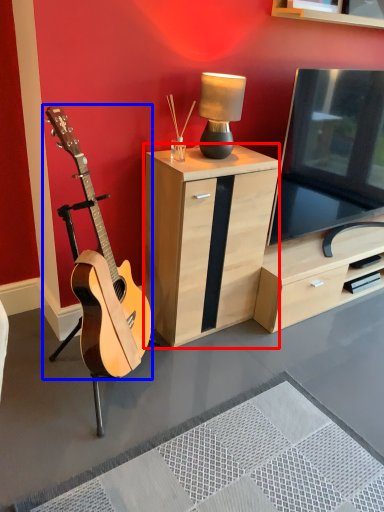
Question: Which point is further to the camera, cabinetry (highlighted by a red box) or guitar (highlighted by a blue box)?

Choices:
 (A) cabinetry
 (B) guitar

Answer: (A)